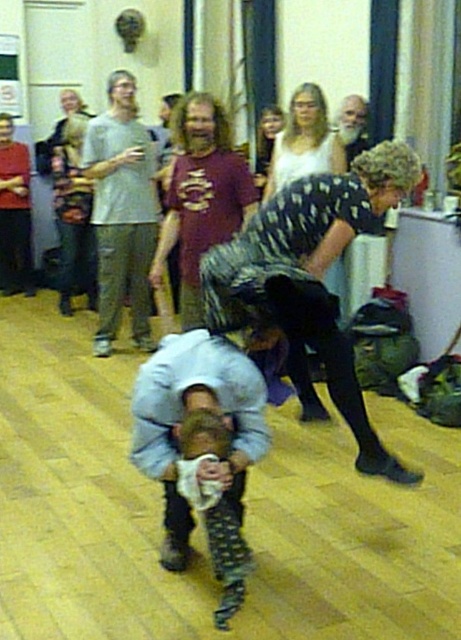
Question: Which object is positioned farthest from the soft beige fabric at center?

Choices:
 (A) white matte tank top at upper center
 (B) light gray t-shirt at upper left
 (C) light blue denim shirt at center

Answer: (B)

Question: Observing the image, what is the correct spatial positioning of soft beige fabric at center in reference to gray beard at upper center?

Choices:
 (A) above
 (B) below

Answer: (B)

Question: Which object is positioned closest to the gray beard at upper center?

Choices:
 (A) light blue denim shirt at center
 (B) soft beige fabric at center

Answer: (A)

Question: Does soft beige fabric at center appear under gray beard at upper center?

Choices:
 (A) yes
 (B) no

Answer: (A)

Question: Among these objects, which one is nearest to the camera?

Choices:
 (A) maroon t-shirt at center
 (B) white matte tank top at upper center
 (C) soft beige fabric at center
 (D) patterned fabric dress at center

Answer: (C)

Question: Can you confirm if light blue denim shirt at center is positioned above gray beard at upper center?

Choices:
 (A) yes
 (B) no

Answer: (B)